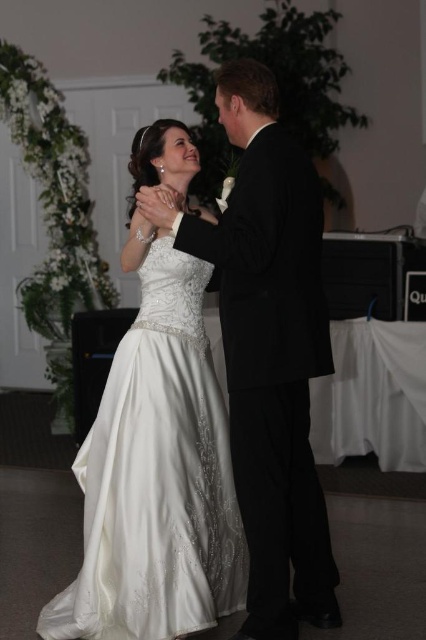
In the scene shown: Who is shorter, satin dress at center or shiny black suit at center?

satin dress at center

What do you see at coordinates (155, 472) in the screenshot? I see `satin dress at center` at bounding box center [155, 472].

At what (x,y) coordinates should I click in order to perform the action: click on satin dress at center. Please return your answer as a coordinate pair (x, y). Looking at the image, I should click on (155, 472).